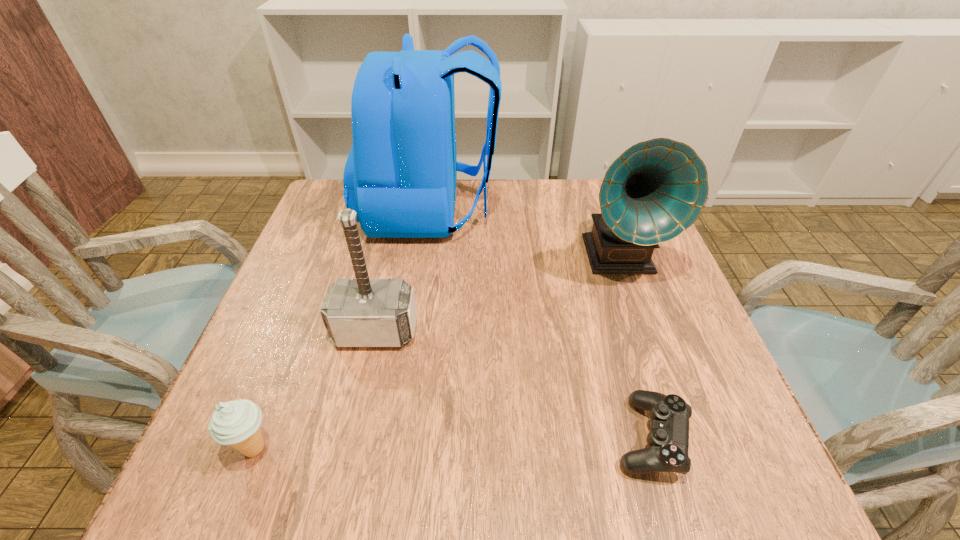
Where is `free area in between the tallest object and the third farthest object`? This screenshot has width=960, height=540. free area in between the tallest object and the third farthest object is located at coordinates (402, 271).

In order to click on vacant space that is in between the phonograph_record and the hammer in this screenshot , I will do `click(497, 294)`.

Identify the location of unoccupied position between the phonograph_record and the control. (635, 347).

The width and height of the screenshot is (960, 540). I want to click on vacant space in between the backpack and the control, so click(540, 323).

Where is `free space between the control and the leftmost object`? free space between the control and the leftmost object is located at coordinates click(x=452, y=443).

What are the coordinates of `vacant space in between the tallest object and the control` in the screenshot? It's located at (540, 323).

The image size is (960, 540). Find the location of `blank region between the phonograph_record and the tallest object`. blank region between the phonograph_record and the tallest object is located at coordinates (524, 234).

Identify which object is located as the second nearest to the phonograph_record. Please provide its 2D coordinates. Your answer should be formatted as a tuple, i.e. [(x, y)], where the tuple contains the x and y coordinates of a point satisfying the conditions above.

[(668, 440)]

I want to click on object identified as the third closest to the icecream, so click(668, 440).

You are a GUI agent. You are given a task and a screenshot of the screen. Output one action in this format:
    pyautogui.click(x=<x>, y=<y>)
    Task: Click on the free space in the image that satisfies the following two spatial constraints: 1. on the back of the tallest object; 2. for striking with the head of the hammer
    
    Given the screenshot: What is the action you would take?
    pyautogui.click(x=412, y=331)